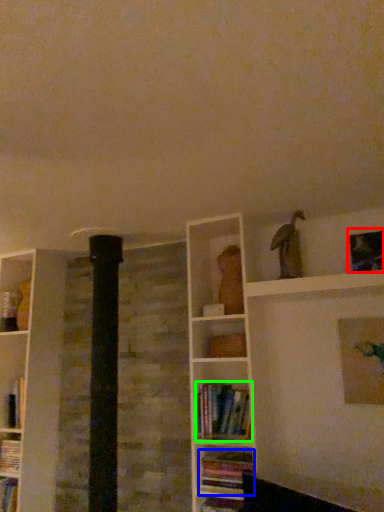
Question: Considering the real-world distances, which object is closest to picture frame (highlighted by a red box)? book (highlighted by a blue box) or book (highlighted by a green box).

Choices:
 (A) book
 (B) book

Answer: (B)